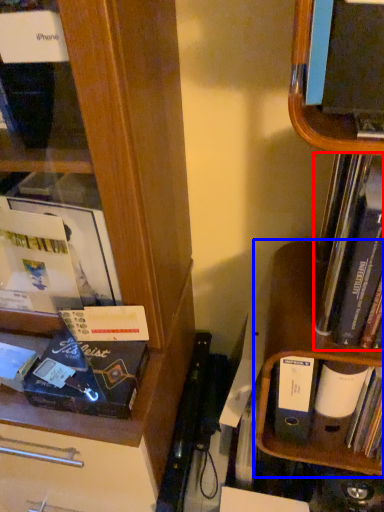
Question: Among these objects, which one is farthest to the camera, book (highlighted by a red box) or cabinet (highlighted by a blue box)?

Choices:
 (A) book
 (B) cabinet

Answer: (B)